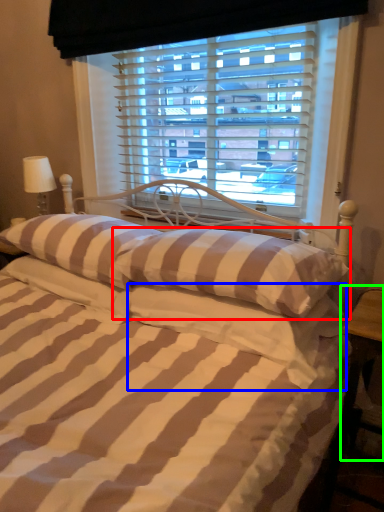
Question: Estimate the real-world distances between objects in this image. Which object is closer to pillow (highlighted by a red box), pillow (highlighted by a blue box) or table (highlighted by a green box)?

Choices:
 (A) pillow
 (B) table

Answer: (A)